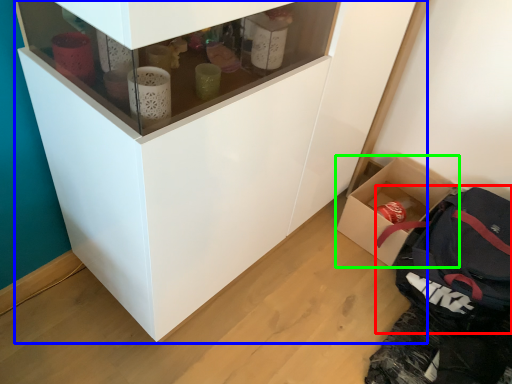
Question: Which object is positioned closest to backpack (highlighted by a red box)? Select from cupboard (highlighted by a blue box) and box (highlighted by a green box).

Choices:
 (A) cupboard
 (B) box

Answer: (B)